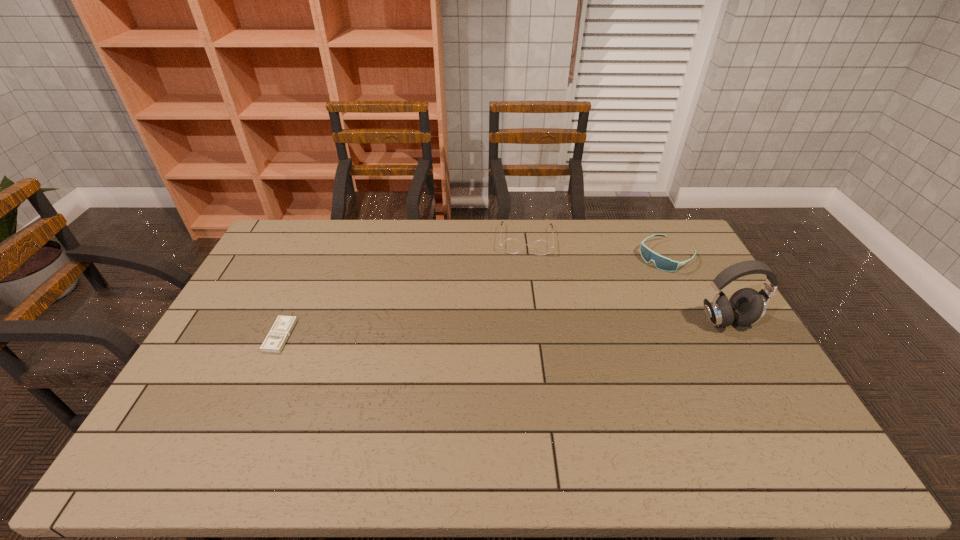
The width and height of the screenshot is (960, 540). I want to click on vacant space located 0.160m on the front-facing side of the spectacles, so click(525, 285).

At what (x,y) coordinates should I click in order to perform the action: click on free space located on the front-facing side of the spectacles. Please return your answer as a coordinate pair (x, y). The height and width of the screenshot is (540, 960). Looking at the image, I should click on (525, 334).

Identify the location of vacant point located 0.390m on the front-facing side of the spectacles. This screenshot has height=540, width=960. (525, 336).

The image size is (960, 540). In order to click on goggles located in the far edge section of the desktop in this screenshot , I will do `click(662, 263)`.

Locate an element on the screen. The height and width of the screenshot is (540, 960). spectacles that is at the far edge is located at coordinates (x=541, y=247).

Where is `object at the left edge`? This screenshot has height=540, width=960. object at the left edge is located at coordinates (274, 342).

At what (x,y) coordinates should I click in order to perform the action: click on headset situated at the right edge. Please return your answer as a coordinate pair (x, y). Looking at the image, I should click on tap(746, 306).

Find the location of a particular element. This screenshot has height=540, width=960. goggles present at the right edge is located at coordinates (662, 263).

Find the location of a particular element. object that is at the far right corner is located at coordinates (662, 263).

This screenshot has height=540, width=960. In the image, there is a desktop. What are the coordinates of `vacant region at the far edge` in the screenshot? It's located at (328, 221).